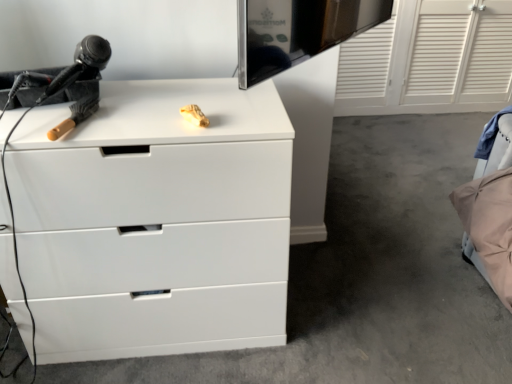
Question: In terms of size, does white matte chest of drawers at center appear bigger or smaller than black plastic hairdryer at left?

Choices:
 (A) big
 (B) small

Answer: (A)

Question: Visually, is white matte chest of drawers at center positioned to the left or to the right of black plastic hairdryer at left?

Choices:
 (A) left
 (B) right

Answer: (B)

Question: Which object is positioned closest to the black plastic hairdryer at left?

Choices:
 (A) white matte chest of drawers at center
 (B) beige fabric bed at lower right

Answer: (A)

Question: Which object is the closest to the black plastic hairdryer at left?

Choices:
 (A) white matte chest of drawers at center
 (B) beige fabric bed at lower right

Answer: (A)